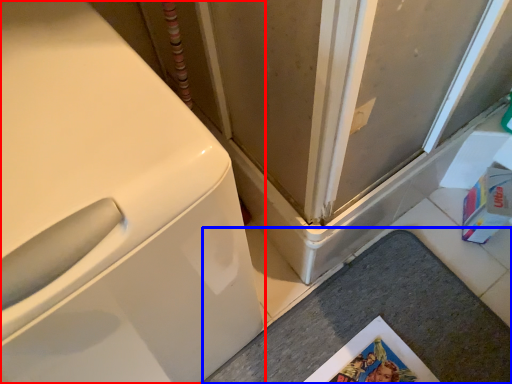
Question: Which point is further to the camera, washing machine (highlighted by a red box) or counter top (highlighted by a blue box)?

Choices:
 (A) washing machine
 (B) counter top

Answer: (B)